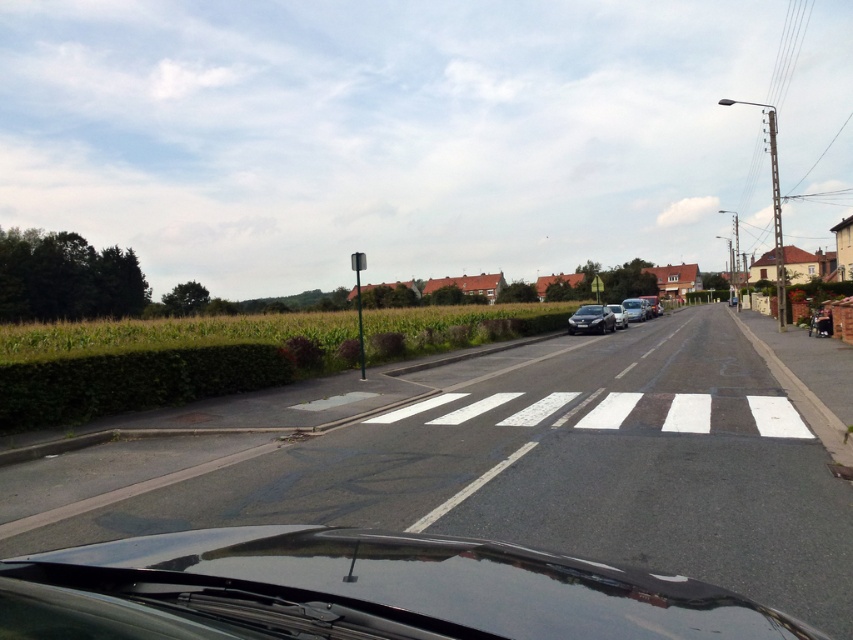
Question: Which object is the closest to the glossy black car at center?

Choices:
 (A) silver metallic car at center-right
 (B) silver metallic car at right
 (C) shiny silver car at center-right

Answer: (C)

Question: Which of the following is the farthest from the observer?

Choices:
 (A) (654, 314)
 (B) (119, 541)

Answer: (A)

Question: Where is glossy black car at center located in relation to shiny silver car at center-right in the image?

Choices:
 (A) above
 (B) below

Answer: (B)

Question: Among these points, which one is farthest from the camera?

Choices:
 (A) (677, 616)
 (B) (604, 308)
 (C) (650, 310)
 (D) (640, 316)

Answer: (C)

Question: Can you confirm if glossy black car at center is wider than silver metallic car at center-right?

Choices:
 (A) yes
 (B) no

Answer: (A)

Question: Does glossy black car at center have a larger size compared to shiny silver car at center-right?

Choices:
 (A) no
 (B) yes

Answer: (A)